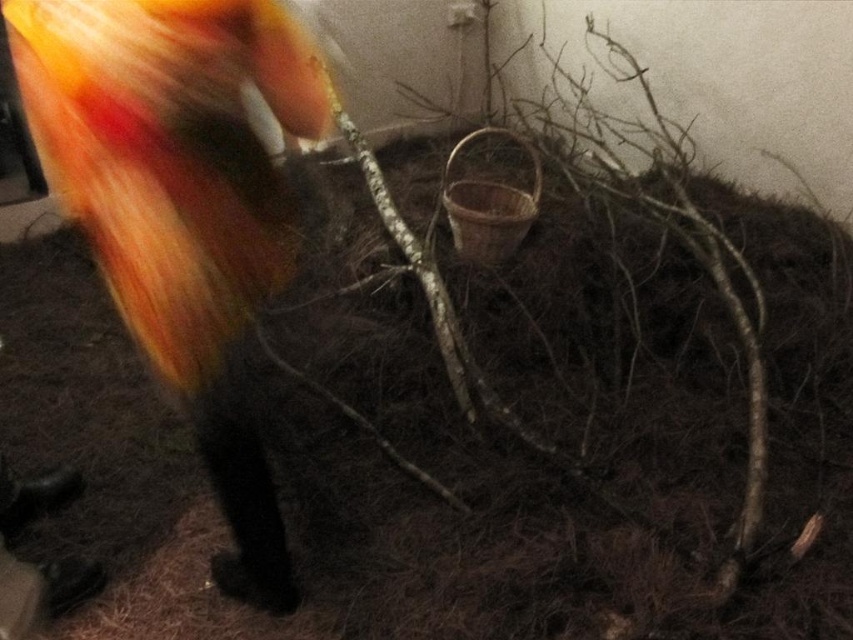
What do you see at coordinates (180, 204) in the screenshot? I see `fluffy orange-yellow tail at upper left` at bounding box center [180, 204].

Is fluffy orange-yellow tail at upper left taller than brown textured stick at center?

No.

Locate an element on the screen. The width and height of the screenshot is (853, 640). fluffy orange-yellow tail at upper left is located at coordinates (180, 204).